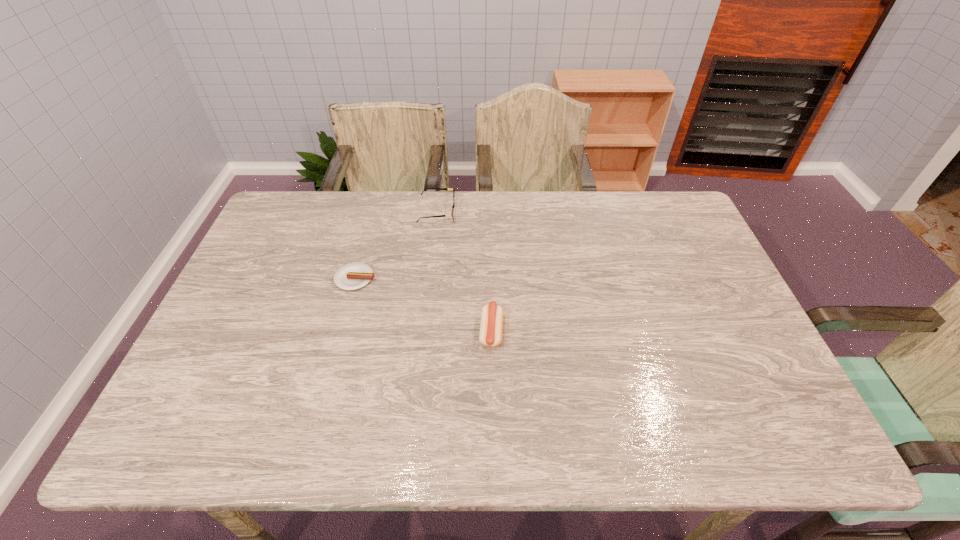
Identify the location of free space that satisfies the following two spatial constraints: 1. on the front-facing side of the nearest object; 2. on the right side of the farthest object. This screenshot has width=960, height=540. (423, 331).

Locate an element on the screen. This screenshot has width=960, height=540. free space that satisfies the following two spatial constraints: 1. on the back side of the right sausage; 2. on the front-facing side of the spectacles is located at coordinates (489, 212).

Where is `free space that satisfies the following two spatial constraints: 1. on the front-facing side of the spectacles; 2. on the right side of the rightmost object`? This screenshot has width=960, height=540. free space that satisfies the following two spatial constraints: 1. on the front-facing side of the spectacles; 2. on the right side of the rightmost object is located at coordinates (423, 331).

Image resolution: width=960 pixels, height=540 pixels. Find the location of `free space that satisfies the following two spatial constraints: 1. on the front side of the nearer sausage; 2. on the left side of the shortest object`. free space that satisfies the following two spatial constraints: 1. on the front side of the nearer sausage; 2. on the left side of the shortest object is located at coordinates (341, 331).

Find the location of a particular element. vacant space that satisfies the following two spatial constraints: 1. on the back side of the nearer sausage; 2. on the front-facing side of the spectacles is located at coordinates (489, 212).